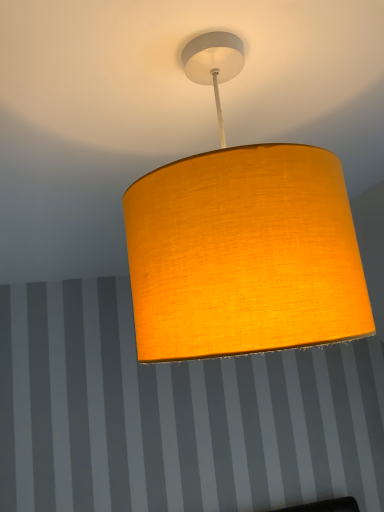
Describe the element at coordinates (242, 243) in the screenshot. The width and height of the screenshot is (384, 512). I see `matte orange fabric lampshade at center` at that location.

This screenshot has height=512, width=384. Find the location of `matte orange fabric lampshade at center`. matte orange fabric lampshade at center is located at coordinates (242, 243).

In order to click on matte orange fabric lampshade at center in this screenshot , I will do `click(242, 243)`.